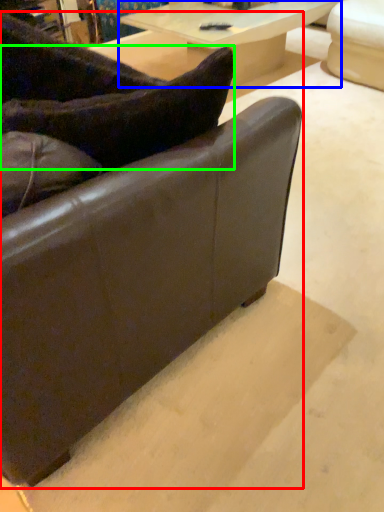
Question: Which object is positioned farthest from studio couch (highlighted by a red box)? Select from table (highlighted by a blue box) and pillow (highlighted by a green box).

Choices:
 (A) table
 (B) pillow

Answer: (A)